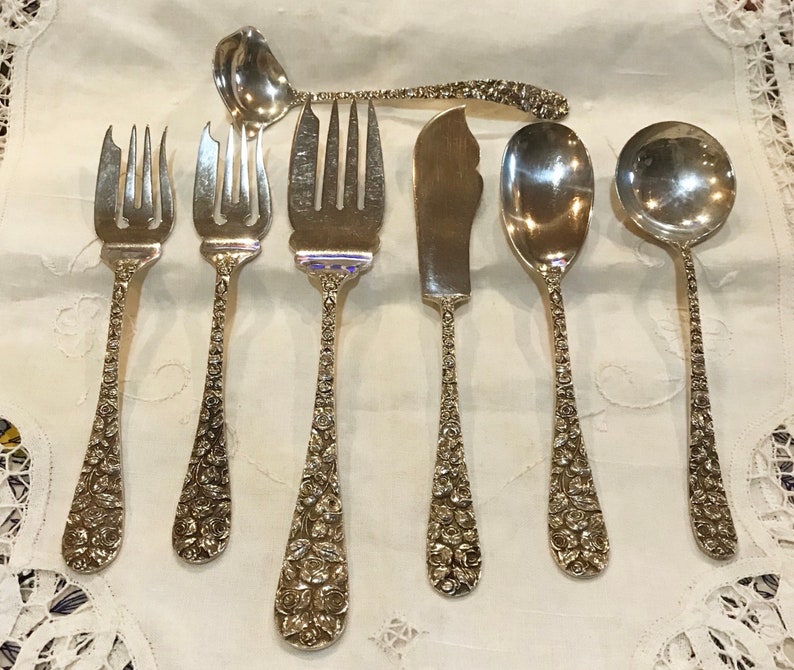
Find the location of a particular element. handles is located at coordinates (110, 442), (195, 505), (305, 570), (434, 541), (565, 527), (731, 507), (536, 100).